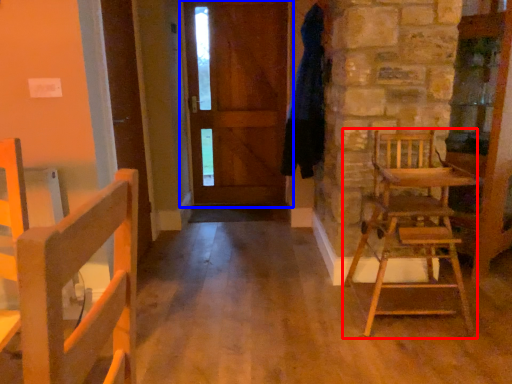
Question: Which object appears closest to the camera in this image, chair (highlighted by a red box) or door (highlighted by a blue box)?

Choices:
 (A) chair
 (B) door

Answer: (A)